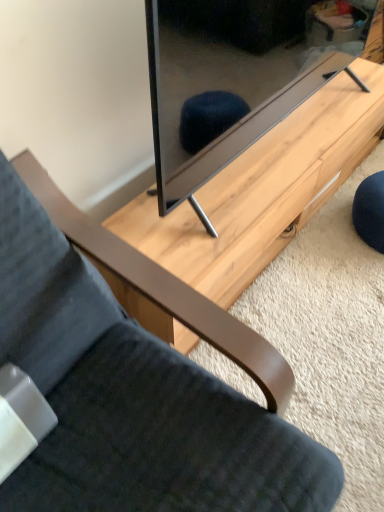
Question: Does velvet dark gray chair at lower left have a lesser height compared to matte black tv at center?

Choices:
 (A) yes
 (B) no

Answer: (B)

Question: Is velvet dark gray chair at lower left not inside matte black tv at center?

Choices:
 (A) yes
 (B) no

Answer: (A)

Question: Is velvet dark gray chair at lower left facing away from matte black tv at center?

Choices:
 (A) no
 (B) yes

Answer: (A)

Question: Are velvet dark gray chair at lower left and matte black tv at center far apart?

Choices:
 (A) yes
 (B) no

Answer: (B)

Question: Can you confirm if velvet dark gray chair at lower left is thinner than matte black tv at center?

Choices:
 (A) no
 (B) yes

Answer: (A)

Question: Does velvet dark gray chair at lower left lie behind matte black tv at center?

Choices:
 (A) no
 (B) yes

Answer: (A)

Question: Considering the relative positions of velvet dark gray chair at lower left and light wood table at center in the image provided, is velvet dark gray chair at lower left to the right of light wood table at center from the viewer's perspective?

Choices:
 (A) yes
 (B) no

Answer: (B)

Question: Are velvet dark gray chair at lower left and light wood table at center beside each other?

Choices:
 (A) no
 (B) yes

Answer: (A)

Question: Is velvet dark gray chair at lower left shorter than light wood table at center?

Choices:
 (A) yes
 (B) no

Answer: (B)

Question: Is velvet dark gray chair at lower left taller than light wood table at center?

Choices:
 (A) yes
 (B) no

Answer: (A)

Question: Is velvet dark gray chair at lower left positioned behind light wood table at center?

Choices:
 (A) no
 (B) yes

Answer: (A)

Question: From a real-world perspective, is velvet dark gray chair at lower left beneath light wood table at center?

Choices:
 (A) no
 (B) yes

Answer: (A)

Question: Does matte black tv at center have a greater width compared to velvet dark gray chair at lower left?

Choices:
 (A) no
 (B) yes

Answer: (A)